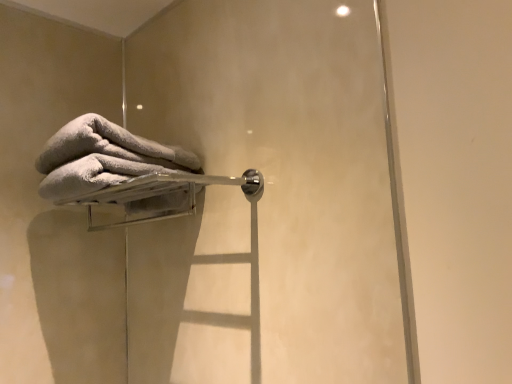
You are a GUI agent. You are given a task and a screenshot of the screen. Output one action in this format:
    pyautogui.click(x=<x>, y=<y>)
    Task: Click on the gray fluffy towels at upper left
    The image size is (512, 384).
    Given the screenshot: What is the action you would take?
    pyautogui.click(x=109, y=146)

Measure the distance between gray fluffy towels at upper left and camera.

The distance of gray fluffy towels at upper left from camera is 36.21 inches.

The height and width of the screenshot is (384, 512). Describe the element at coordinates (109, 146) in the screenshot. I see `gray fluffy towels at upper left` at that location.

The image size is (512, 384). I want to click on gray fluffy towels at upper left, so click(x=109, y=146).